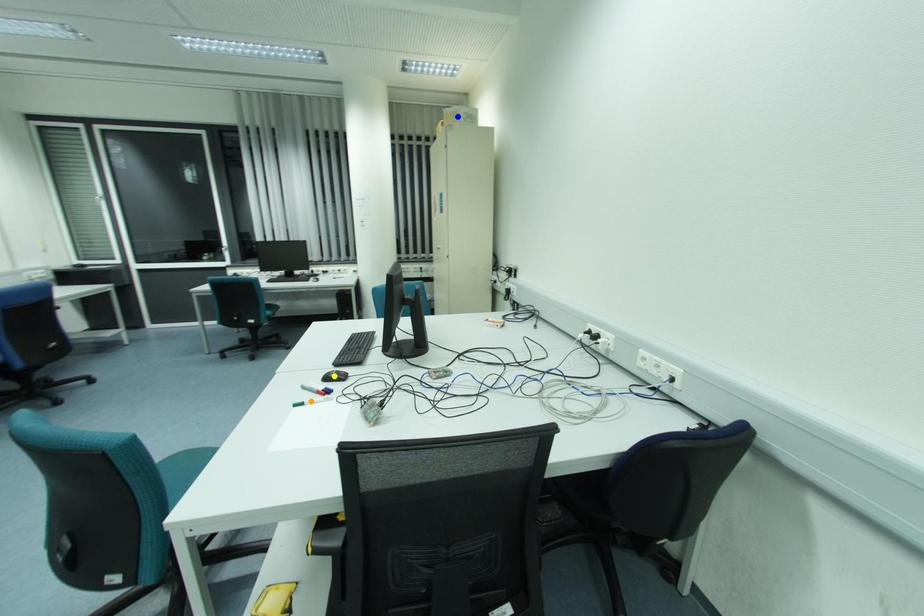
Order these from nearest to farthest:
yellow point
blue point
orange point

1. orange point
2. yellow point
3. blue point